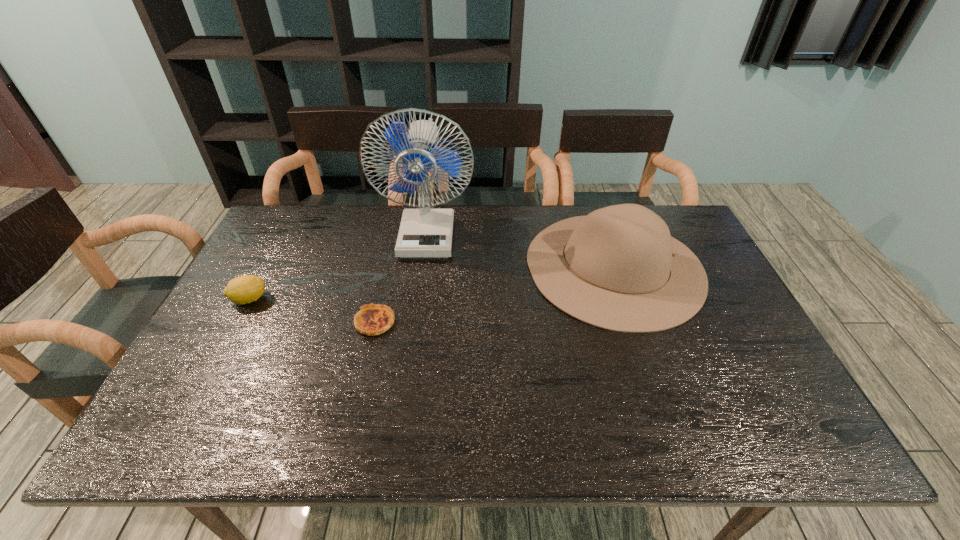
Identify the location of the tallest object. (426, 232).

Locate an element on the screen. sombrero is located at coordinates (618, 268).

Locate an element on the screen. the second tallest object is located at coordinates (618, 268).

Identify the location of lemon. (245, 289).

This screenshot has height=540, width=960. Identify the location of the third tallest object. (245, 289).

Image resolution: width=960 pixels, height=540 pixels. In order to click on quiche in this screenshot , I will do `click(373, 319)`.

The width and height of the screenshot is (960, 540). In order to click on free space located 0.160m on the front-facing side of the fan in this screenshot , I will do `click(418, 298)`.

Identify the location of free spot located on the left of the sombrero. (396, 267).

You are a GUI agent. You are given a task and a screenshot of the screen. Output one action in this format:
    pyautogui.click(x=<x>, y=<y>)
    Task: Click on the blank area located 0.060m at the stem end of the lemon
    
    Given the screenshot: What is the action you would take?
    pyautogui.click(x=290, y=299)

Locate an element on the screen. This screenshot has width=960, height=540. vacant point located 0.060m on the back of the shortest object is located at coordinates (382, 292).